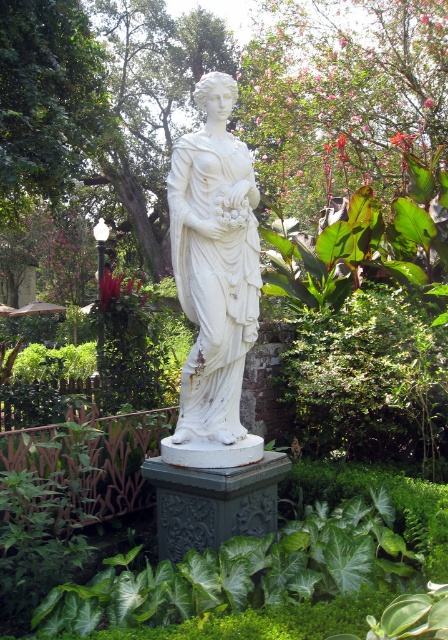
Question: Is the position of green leafy tree at center less distant than that of white marble statue at center?

Choices:
 (A) yes
 (B) no

Answer: (B)

Question: Can you confirm if green leafy tree at center is bigger than white marble statue at center?

Choices:
 (A) no
 (B) yes

Answer: (B)

Question: Can you confirm if green leafy tree at center is thinner than white marble statue at center?

Choices:
 (A) yes
 (B) no

Answer: (B)

Question: Which object is closer to the camera taking this photo?

Choices:
 (A) green leafy tree at center
 (B) white marble statue at center

Answer: (B)